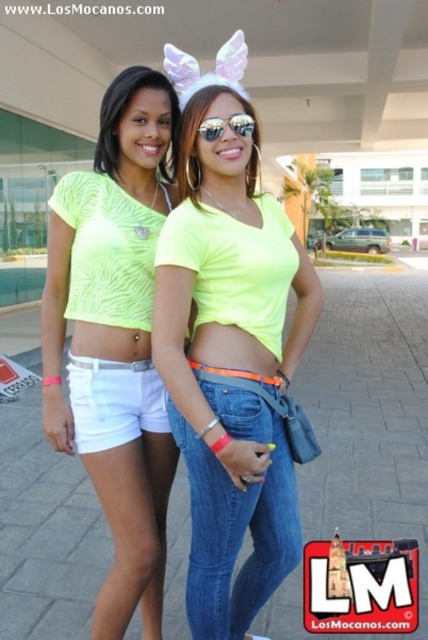
You are a fashion designer observing two people in the image. You notice both are wearing neon yellow clothing. The neon yellow fabric top at center is worn by one person, and the neon yellow fabric shorts at lower left by another. Which clothing item is located more to the right?

The neon yellow fabric top at center is positioned on the right side of neon yellow fabric shorts at lower left, so the neon yellow fabric top at center is more to the right.

You are a fashion designer observing two people in the image. You need to determine if the neon yellow fabric top at center and the white cotton shorts at lower left can be paired together in a coordinated outfit. Based on their positions in the image, can they be worn by the same person?

The neon yellow fabric top at center and the white cotton shorts at lower left are positioned 12.35 inches apart in the image. Since this distance suggests they belong to different individuals, they cannot be paired together on the same person.

You are standing in the public area shown in the image and want to determine which of the two points, point (284, 488) or point (113, 157), is nearer to you. Based on the scene, which point is closer?

Point (284, 488) is closer to the viewer than point (113, 157).